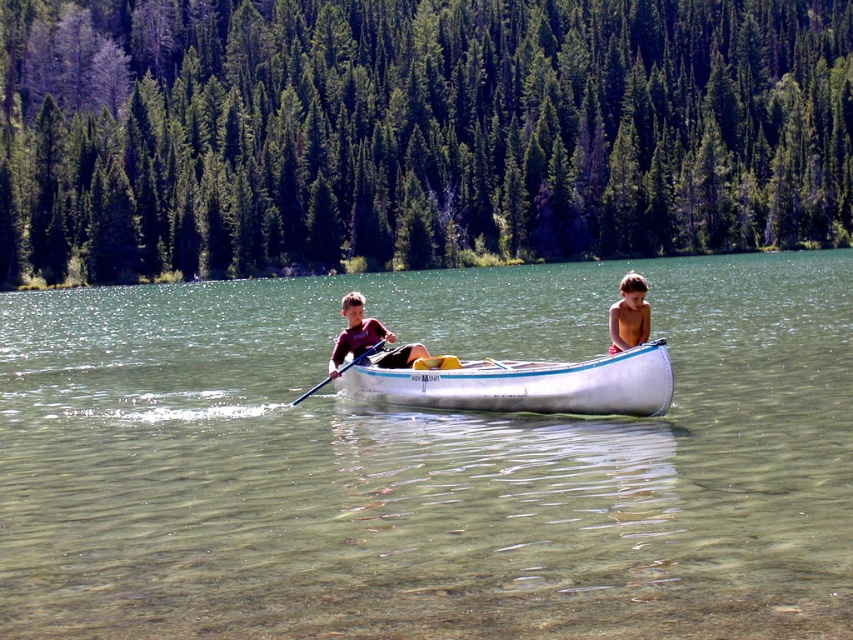
You are a photographer trying to capture the white polished wood canoe at center and the dark red fabric shirt at center in a single shot. Since you want both subjects to be clearly visible, which object should you focus on first to ensure proper focus, considering their sizes?

The white polished wood canoe at center is smaller than the dark red fabric shirt at center, so you should focus on the white polished wood canoe at center first to ensure its details are sharp, as smaller objects often require more precise focusing to maintain clarity.

You are a photographer trying to capture the white polished wood canoe at center in your shot. You notice a point marked at coordinates [523,385]. Where is this point located relative to the white polished wood canoe at center?

The point at coordinates [523,385] corresponds to the white polished wood canoe at center, so it is located exactly at the center of the canoe.

You are a lifeguard on duty and see the white polished wood canoe at center and the smooth skin boy at center in the water. Based on their sizes, which one might be easier to spot from a distance?

The smooth skin boy at center is larger in size compared to the white polished wood canoe at center, so the smooth skin boy at center would be easier to spot from a distance.